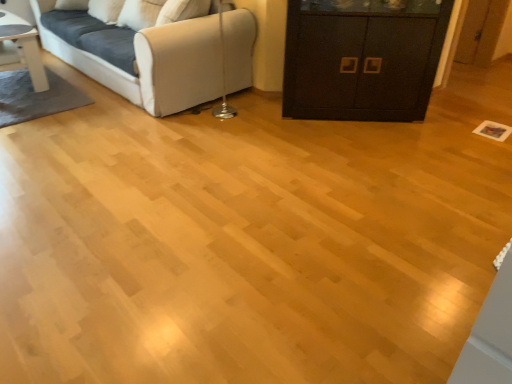
Question: Does black matte cabinet at center turn towards white glossy table at upper left?

Choices:
 (A) no
 (B) yes

Answer: (A)

Question: From the image's perspective, is black matte cabinet at center below white glossy table at upper left?

Choices:
 (A) no
 (B) yes

Answer: (B)

Question: Is black matte cabinet at center turned away from white glossy table at upper left?

Choices:
 (A) yes
 (B) no

Answer: (B)

Question: Is black matte cabinet at center outside white glossy table at upper left?

Choices:
 (A) yes
 (B) no

Answer: (A)

Question: Is black matte cabinet at center next to white glossy table at upper left?

Choices:
 (A) yes
 (B) no

Answer: (B)

Question: From a real-world perspective, is black matte cabinet at center on top of white glossy table at upper left?

Choices:
 (A) yes
 (B) no

Answer: (A)

Question: Is white fabric couch at upper left shorter than black matte cabinet at center?

Choices:
 (A) yes
 (B) no

Answer: (A)

Question: From the image's perspective, is white fabric couch at upper left above black matte cabinet at center?

Choices:
 (A) yes
 (B) no

Answer: (A)

Question: Does white fabric couch at upper left appear on the left side of black matte cabinet at center?

Choices:
 (A) yes
 (B) no

Answer: (A)

Question: From the image's perspective, is white fabric couch at upper left beneath black matte cabinet at center?

Choices:
 (A) no
 (B) yes

Answer: (A)

Question: Considering the relative sizes of white fabric couch at upper left and black matte cabinet at center in the image provided, is white fabric couch at upper left wider than black matte cabinet at center?

Choices:
 (A) yes
 (B) no

Answer: (A)

Question: From a real-world perspective, is white fabric couch at upper left located higher than black matte cabinet at center?

Choices:
 (A) yes
 (B) no

Answer: (B)

Question: Considering the relative sizes of white glossy table at upper left and white fabric couch at upper left in the image provided, is white glossy table at upper left smaller than white fabric couch at upper left?

Choices:
 (A) no
 (B) yes

Answer: (B)